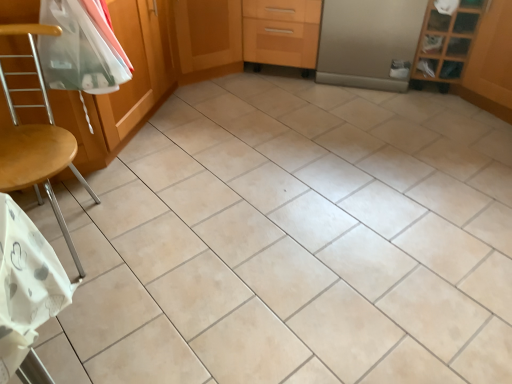
Question: Can you confirm if satin silver refrigerator at center, which appears as the 2th screen door when viewed from the left, is positioned to the left of wooden shelf at upper right?

Choices:
 (A) no
 (B) yes

Answer: (B)

Question: Considering the relative positions of satin silver refrigerator at center, the 1th screen door positioned from the right, and wooden shelf at upper right in the image provided, is satin silver refrigerator at center, the 1th screen door positioned from the right, in front of wooden shelf at upper right?

Choices:
 (A) no
 (B) yes

Answer: (A)

Question: Is satin silver refrigerator at center, which appears as the 2th screen door when viewed from the left, positioned with its back to wooden shelf at upper right?

Choices:
 (A) no
 (B) yes

Answer: (A)

Question: Can you see satin silver refrigerator at center, which appears as the 2th screen door when viewed from the left, touching wooden shelf at upper right?

Choices:
 (A) yes
 (B) no

Answer: (B)

Question: From a real-world perspective, is satin silver refrigerator at center, the 1th screen door positioned from the right, below wooden shelf at upper right?

Choices:
 (A) no
 (B) yes

Answer: (B)

Question: From a real-world perspective, does satin silver refrigerator at center, which appears as the 2th screen door when viewed from the left, stand above wooden shelf at upper right?

Choices:
 (A) yes
 (B) no

Answer: (B)

Question: Can wooden shelf at upper right be found inside wooden at left?

Choices:
 (A) yes
 (B) no

Answer: (B)

Question: Is wooden at left thinner than wooden shelf at upper right?

Choices:
 (A) no
 (B) yes

Answer: (B)

Question: Does wooden at left lie in front of wooden shelf at upper right?

Choices:
 (A) yes
 (B) no

Answer: (A)

Question: Is wooden at left turned away from wooden shelf at upper right?

Choices:
 (A) no
 (B) yes

Answer: (A)

Question: Is wooden at left outside of wooden shelf at upper right?

Choices:
 (A) no
 (B) yes

Answer: (B)

Question: Considering the relative sizes of wooden at left and wooden shelf at upper right in the image provided, is wooden at left smaller than wooden shelf at upper right?

Choices:
 (A) yes
 (B) no

Answer: (B)

Question: From a real-world perspective, does satin silver refrigerator at center, the 1th screen door positioned from the right, stand above wooden at left?

Choices:
 (A) yes
 (B) no

Answer: (B)